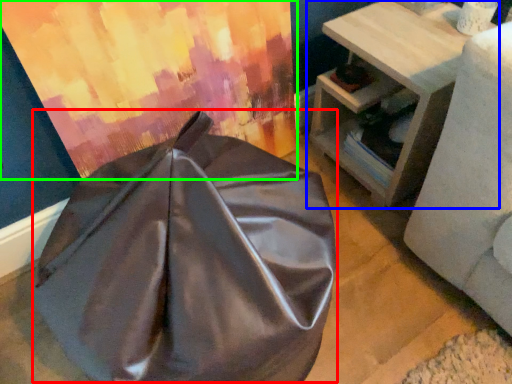
Question: Which object is positioned closest to bean bag chair (highlighted by a red box)? Select from table (highlighted by a blue box) and curtain (highlighted by a green box).

Choices:
 (A) table
 (B) curtain

Answer: (B)